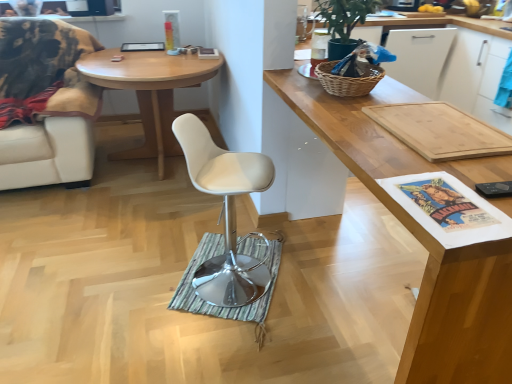
Describe the element at coordinates (343, 23) in the screenshot. This screenshot has height=384, width=512. I see `green matte plant at upper right` at that location.

The image size is (512, 384). What are the coordinates of `wooden cutting board at upper right` in the screenshot? It's located at (424, 244).

What do you see at coordinates (149, 92) in the screenshot? I see `light wood desk at center` at bounding box center [149, 92].

Describe the element at coordinates (47, 103) in the screenshot. I see `white leather chair at left` at that location.

Where is `green matte plant at upper right`? This screenshot has height=384, width=512. green matte plant at upper right is located at coordinates (343, 23).

Is green striped mat at center positioned beyond the bounds of green matte plant at upper right?

green striped mat at center lies outside green matte plant at upper right's area.

Between green striped mat at center and green matte plant at upper right, which one has smaller width?

Thinner between the two is green matte plant at upper right.

Between green striped mat at center and green matte plant at upper right, which one appears on the left side from the viewer's perspective?

green striped mat at center is more to the left.

Could you tell me if green striped mat at center is facing green matte plant at upper right?

No, green striped mat at center is not oriented towards green matte plant at upper right.

Are green striped mat at center and white leather chair at left making contact?

green striped mat at center and white leather chair at left are clearly separated.

Does point (267, 304) come in front of point (27, 49)?

Yes, it is in front of point (27, 49).

The image size is (512, 384). Identify the location of mat below the white leather chair at left (from the image's perspective). (221, 306).

Is the position of green striped mat at center less distant than that of white leather chair at left?

Yes, the depth of green striped mat at center is less than that of white leather chair at left.

You are a GUI agent. You are given a task and a screenshot of the screen. Output one action in this format:
    pyautogui.click(x=<x>, y=<y>)
    Task: Click on the desk below the white leather chair at left (from the image's perspective)
    
    Given the screenshot: What is the action you would take?
    pyautogui.click(x=149, y=92)

Is light wood desk at center completely or partially outside of white leather chair at left?

Yes, light wood desk at center is outside of white leather chair at left.

Is light wood desk at center in front of white leather chair at left?

No, light wood desk at center is behind white leather chair at left.

Which of these two, green striped mat at center or wooden cutting board at upper right, is wider?

With larger width is wooden cutting board at upper right.

The width and height of the screenshot is (512, 384). What are the coordinates of `cabinetry to the right of green striped mat at center` in the screenshot? It's located at (424, 244).

Can you confirm if green striped mat at center is positioned to the right of wooden cutting board at upper right?

Incorrect, green striped mat at center is not on the right side of wooden cutting board at upper right.

Does point (221, 252) come closer to viewer compared to point (311, 105)?

No, (221, 252) is further to viewer.

Is white leather chair at left wider than white leather swivel chair at center?

Yes.

How many degrees apart are the facing directions of white leather chair at left and white leather swivel chair at center?

66 degrees.

From the image's perspective, relative to white leather swivel chair at center, is white leather chair at left above or below?

From the image's perspective, white leather chair at left appears above white leather swivel chair at center.

Based on the photo, is white leather swivel chair at center completely or partially inside white leather chair at left?

No, white leather swivel chair at center is located outside of white leather chair at left.

Which of these two, green matte plant at upper right or green striped mat at center, is bigger?

With larger size is green matte plant at upper right.

Is green matte plant at upper right positioned beyond the bounds of green striped mat at center?

Yes, green matte plant at upper right is located beyond the bounds of green striped mat at center.

How different are the orientations of green matte plant at upper right and green striped mat at center in degrees?

There is a 21.1-degree angle between the facing directions of green matte plant at upper right and green striped mat at center.

Looking at this image, in the image, is green matte plant at upper right on the left side or the right side of green striped mat at center?

From the image, it's evident that green matte plant at upper right is to the right of green striped mat at center.

Does white leather chair at left appear on the left side of woven wicker picnic basket at upper right?

Yes, white leather chair at left is to the left of woven wicker picnic basket at upper right.

Does white leather chair at left turn towards woven wicker picnic basket at upper right?

No, white leather chair at left is not turned towards woven wicker picnic basket at upper right.

Which of these two, white leather chair at left or woven wicker picnic basket at upper right, is thinner?

woven wicker picnic basket at upper right.

Considering the sizes of objects white leather chair at left and woven wicker picnic basket at upper right in the image provided, who is bigger, white leather chair at left or woven wicker picnic basket at upper right?

white leather chair at left.

Find the location of a particular element. Image resolution: width=512 pixels, height=384 pixels. mat below the green matte plant at upper right (from a real-world perspective) is located at coordinates (221, 306).

Where is `mat on the right of white leather chair at left`? This screenshot has height=384, width=512. mat on the right of white leather chair at left is located at coordinates coord(221,306).

Considering their positions, is green striped mat at center positioned further to woven wicker picnic basket at upper right than white leather swivel chair at center?

green striped mat at center is further to woven wicker picnic basket at upper right.

Which object lies further to the anchor point wooden cutting board at upper right, green matte plant at upper right or green striped mat at center?

green striped mat at center is positioned further to the anchor wooden cutting board at upper right.

Which object lies further to the anchor point wooden cutting board at upper right, white leather chair at left or green matte plant at upper right?

Based on the image, white leather chair at left appears to be further to wooden cutting board at upper right.

Considering their positions, is white leather swivel chair at center positioned closer to woven wicker picnic basket at upper right than green striped mat at center?

Among the two, white leather swivel chair at center is located nearer to woven wicker picnic basket at upper right.

Based on their spatial positions, is white leather chair at left or woven wicker picnic basket at upper right further from green striped mat at center?

The object further to green striped mat at center is white leather chair at left.

Estimate the real-world distances between objects in this image. Which object is closer to green matte plant at upper right, white leather chair at left or light wood desk at center?

light wood desk at center is closer to green matte plant at upper right.

Which object lies nearer to the anchor point light wood desk at center, woven wicker picnic basket at upper right or green striped mat at center?

green striped mat at center is positioned closer to the anchor light wood desk at center.

Estimate the real-world distances between objects in this image. Which object is further from white leather chair at left, green striped mat at center or woven wicker picnic basket at upper right?

Among the two, woven wicker picnic basket at upper right is located further to white leather chair at left.

At what (x,y) coordinates should I click in order to perform the action: click on desk that lies between green matte plant at upper right and green striped mat at center from top to bottom. Please return your answer as a coordinate pair (x, y). This screenshot has height=384, width=512. Looking at the image, I should click on (149, 92).

The height and width of the screenshot is (384, 512). What are the coordinates of `desk between white leather chair at left and white leather swivel chair at center from left to right` in the screenshot? It's located at (149, 92).

Identify the location of picnic basket between wooden cutting board at upper right and green striped mat at center in the front-back direction. The image size is (512, 384). (349, 80).

Locate an element on the screen. swivel chair located between white leather chair at left and wooden cutting board at upper right in the left-right direction is located at coordinates (226, 213).